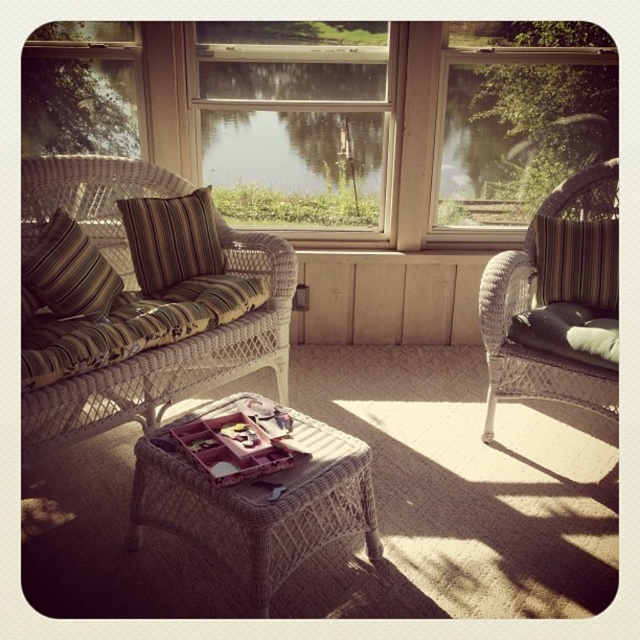
Question: Estimate the real-world distances between objects in this image. Which object is closer to the woven rattan chair at right?

Choices:
 (A) wooden tray at center
 (B) brown striped pillow at left

Answer: (A)

Question: From the image, what is the correct spatial relationship of striped fabric pillow at right in relation to striped fabric pillow at left?

Choices:
 (A) left
 (B) right

Answer: (B)

Question: Is brown striped pillow at left positioned before striped fabric pillow at right?

Choices:
 (A) no
 (B) yes

Answer: (A)

Question: Where is clear glass window at center located in relation to transparent glass window at upper right in the image?

Choices:
 (A) below
 (B) above

Answer: (B)

Question: Which is farther from the woven rattan chair at right?

Choices:
 (A) transparent glass window at upper right
 (B) clear glass window at center

Answer: (B)

Question: Which object is farther from the camera taking this photo?

Choices:
 (A) transparent glass window at upper right
 (B) brown woven stool at center

Answer: (A)